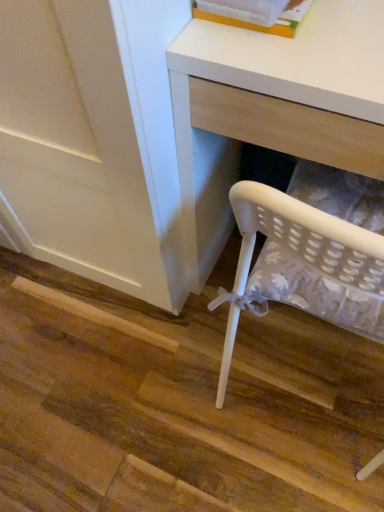
Question: Is white matte desk at lower right at the left side of white plastic book at upper center?

Choices:
 (A) yes
 (B) no

Answer: (B)

Question: From a real-world perspective, is white matte desk at lower right physically below white plastic book at upper center?

Choices:
 (A) no
 (B) yes

Answer: (B)

Question: Can you confirm if white matte desk at lower right is taller than white plastic book at upper center?

Choices:
 (A) yes
 (B) no

Answer: (A)

Question: Considering the relative sizes of white matte desk at lower right and white plastic book at upper center in the image provided, is white matte desk at lower right shorter than white plastic book at upper center?

Choices:
 (A) no
 (B) yes

Answer: (A)

Question: Does white matte desk at lower right have a greater width compared to white plastic book at upper center?

Choices:
 (A) yes
 (B) no

Answer: (A)

Question: Could you tell me if white matte desk at lower right is turned towards white plastic book at upper center?

Choices:
 (A) yes
 (B) no

Answer: (B)

Question: From a real-world perspective, is white plastic book at upper center located higher than white matte desk at lower right?

Choices:
 (A) yes
 (B) no

Answer: (A)

Question: Does white plastic book at upper center have a smaller size compared to white matte desk at lower right?

Choices:
 (A) yes
 (B) no

Answer: (A)

Question: Is white matte desk at lower right surrounded by white plastic book at upper center?

Choices:
 (A) yes
 (B) no

Answer: (B)

Question: Is white plastic book at upper center not inside white matte desk at lower right?

Choices:
 (A) no
 (B) yes

Answer: (B)

Question: From the image's perspective, does white plastic book at upper center appear higher than white matte desk at lower right?

Choices:
 (A) no
 (B) yes

Answer: (B)

Question: Does white plastic book at upper center have a larger size compared to white matte desk at lower right?

Choices:
 (A) yes
 (B) no

Answer: (B)

Question: Is white plastic book at upper center situated inside white matte desk at lower right or outside?

Choices:
 (A) outside
 (B) inside

Answer: (A)